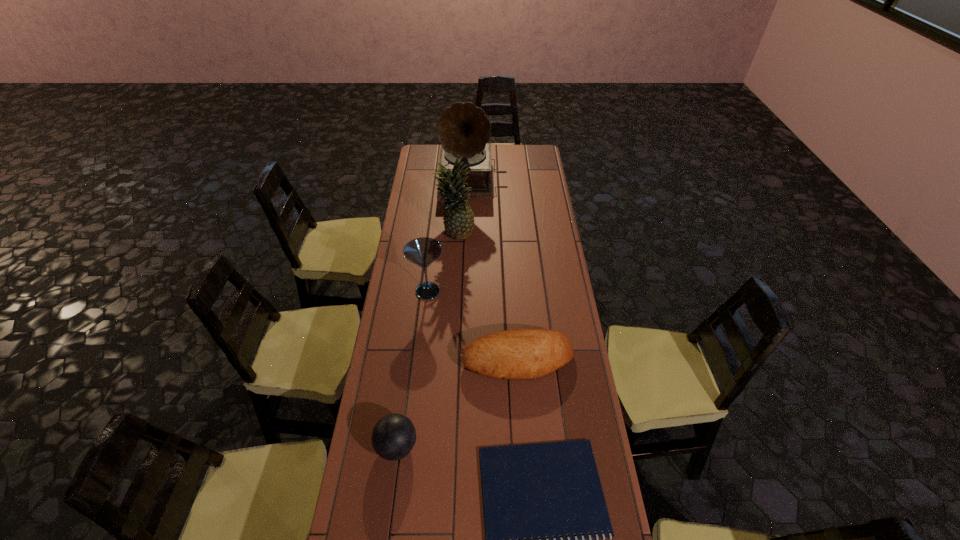
Where is `the farthest object`? the farthest object is located at coordinates (463, 129).

The height and width of the screenshot is (540, 960). Identify the location of the fifth nearest object. (458, 218).

The height and width of the screenshot is (540, 960). Find the location of `pineapple`. pineapple is located at coordinates (458, 218).

This screenshot has width=960, height=540. I want to click on martini, so click(x=423, y=251).

Identify the location of the fourth nearest object. This screenshot has width=960, height=540. (423, 251).

Find the location of `bowling ball`. bowling ball is located at coordinates (394, 435).

In order to click on the third nearest object in this screenshot , I will do `click(519, 354)`.

This screenshot has height=540, width=960. Identify the location of bread. (519, 354).

Locate an element on the screen. This screenshot has width=960, height=540. free location located from the horn of the farthest object is located at coordinates (471, 215).

Locate an element on the screen. The height and width of the screenshot is (540, 960). vacant point located on the back of the pineapple is located at coordinates (458, 201).